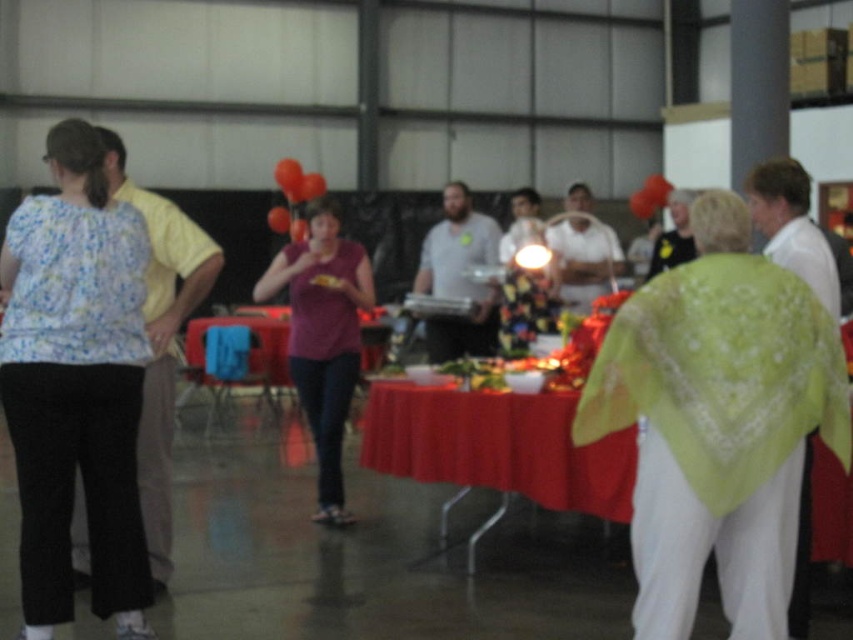
You are a photographer at the event and want to capture a photo that includes both the floral fabric blouse at left and the red fabric table at center. Which object should be placed closer to the camera to ensure both are in focus?

The floral fabric blouse at left is taller than the red fabric table at center, so to ensure both are in focus, the photographer should place the red fabric table at center closer to the camera.

You are planning to take a photo of the orange matte balloon at center and the red matte balloon at center. Since you want both balloons to appear equally large in the photo, which balloon should you move closer to the camera?

The orange matte balloon at center should be moved closer to the camera because it is smaller in size compared to the red matte balloon at center. By moving the smaller orange matte balloon at center closer, its image size in the photo will increase to match the larger red matte balloon at center which is farther away.